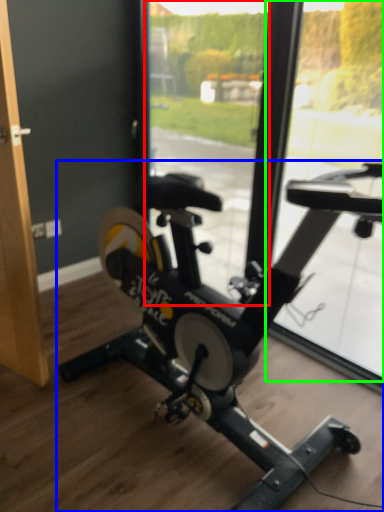
Question: Which object is positioned closest to window screen (highlighted by a red box)? Select from stationary bicycle (highlighted by a blue box) and window screen (highlighted by a green box).

Choices:
 (A) stationary bicycle
 (B) window screen

Answer: (B)